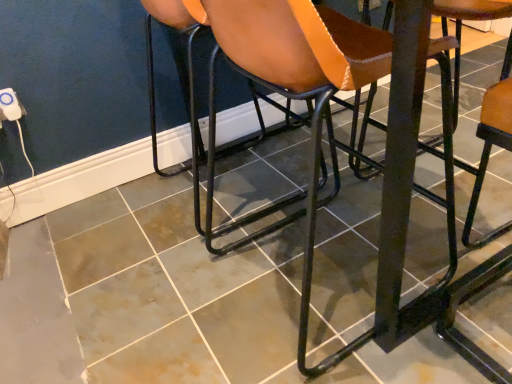
This screenshot has width=512, height=384. Find the location of `brown leather chair at center, arranged as the second chair when viewed from the right`. brown leather chair at center, arranged as the second chair when viewed from the right is located at coordinates (291, 84).

The height and width of the screenshot is (384, 512). What do you see at coordinates (291, 84) in the screenshot? I see `brown leather chair at center, arranged as the second chair when viewed from the right` at bounding box center [291, 84].

Measure the distance between brown leather chair at center, the 1th chair from the left, and camera.

A distance of 4.00 feet exists between brown leather chair at center, the 1th chair from the left, and camera.

At what (x,y) coordinates should I click in order to perform the action: click on brown leather chair at center, positioned as the second chair in left-to-right order. Please return your answer as a coordinate pair (x, y). The height and width of the screenshot is (384, 512). Looking at the image, I should click on (291, 84).

From the image's perspective, between white plastic electric outlet at lower left and metallic black stool at right, which ranks as the 1th chair in right-to-left order, who is located below?

metallic black stool at right, which ranks as the 1th chair in right-to-left order, from the image's perspective.

Which of these two, white plastic electric outlet at lower left or metallic black stool at right, which ranks as the 1th chair in right-to-left order, is bigger?

metallic black stool at right, which ranks as the 1th chair in right-to-left order.

How much distance is there between brown leather chair at center, the 1th chair from the left, and brown leather chair at center, arranged as the second chair when viewed from the right?

brown leather chair at center, the 1th chair from the left, is 11.35 inches from brown leather chair at center, arranged as the second chair when viewed from the right.

Between brown leather chair at center, the 1th chair from the left, and brown leather chair at center, arranged as the second chair when viewed from the right, which one has larger width?

brown leather chair at center, the 1th chair from the left.

From their relative heights in the image, would you say brown leather chair at center, the 1th chair from the left, is taller or shorter than brown leather chair at center, arranged as the second chair when viewed from the right?

brown leather chair at center, the 1th chair from the left, is shorter than brown leather chair at center, arranged as the second chair when viewed from the right.

Does point (234, 57) appear closer or farther from the camera than point (336, 363)?

Point (234, 57).

Visually, is metallic black stool at right, which ranks as the 1th chair in right-to-left order, positioned to the left or to the right of brown leather chair at center, arranged as the second chair when viewed from the right?

Clearly, metallic black stool at right, which ranks as the 1th chair in right-to-left order, is on the right of brown leather chair at center, arranged as the second chair when viewed from the right, in the image.

Does metallic black stool at right, which is the third chair in left-to-right order, contain brown leather chair at center, arranged as the second chair when viewed from the right?

No, brown leather chair at center, arranged as the second chair when viewed from the right, is not surrounded by metallic black stool at right, which is the third chair in left-to-right order.

Would you consider metallic black stool at right, which ranks as the 1th chair in right-to-left order, to be distant from brown leather chair at center, positioned as the second chair in left-to-right order?

metallic black stool at right, which ranks as the 1th chair in right-to-left order, is near brown leather chair at center, positioned as the second chair in left-to-right order, not far away.

From a real-world perspective, which is physically below, metallic black stool at right, which is the third chair in left-to-right order, or brown leather chair at center, positioned as the second chair in left-to-right order?

In real-world perspective, metallic black stool at right, which is the third chair in left-to-right order, is lower.

Considering the relative positions of brown leather chair at center, positioned as the second chair in left-to-right order, and metallic black stool at right, which ranks as the 1th chair in right-to-left order, in the image provided, is brown leather chair at center, positioned as the second chair in left-to-right order, to the left of metallic black stool at right, which ranks as the 1th chair in right-to-left order, from the viewer's perspective?

Yes.

How far apart are brown leather chair at center, positioned as the second chair in left-to-right order, and metallic black stool at right, which is the third chair in left-to-right order?

A distance of 13.46 inches exists between brown leather chair at center, positioned as the second chair in left-to-right order, and metallic black stool at right, which is the third chair in left-to-right order.

Where is `the 1st chair behind the brown leather chair at center, positioned as the second chair in left-to-right order, starting your count from the anchor`? The width and height of the screenshot is (512, 384). the 1st chair behind the brown leather chair at center, positioned as the second chair in left-to-right order, starting your count from the anchor is located at coordinates (465, 301).

Considering the sizes of objects brown leather chair at center, arranged as the second chair when viewed from the right, and metallic black stool at right, which ranks as the 1th chair in right-to-left order, in the image provided, who is bigger, brown leather chair at center, arranged as the second chair when viewed from the right, or metallic black stool at right, which ranks as the 1th chair in right-to-left order,?

With larger size is brown leather chair at center, arranged as the second chair when viewed from the right.

Between brown leather chair at center, positioned as the second chair in left-to-right order, and white plastic electric outlet at lower left, which one has smaller width?

white plastic electric outlet at lower left.

Does brown leather chair at center, arranged as the second chair when viewed from the right, appear on the left side of white plastic electric outlet at lower left?

No.

From a real-world perspective, is brown leather chair at center, positioned as the second chair in left-to-right order, positioned under white plastic electric outlet at lower left based on gravity?

Yes, from a real-world perspective, brown leather chair at center, positioned as the second chair in left-to-right order, is beneath white plastic electric outlet at lower left.

Can you tell me how much brown leather chair at center, the 3th chair viewed from the right, and white plastic electric outlet at lower left differ in facing direction?

The angular difference between brown leather chair at center, the 3th chair viewed from the right, and white plastic electric outlet at lower left is 88.5 degrees.

From a real-world perspective, relative to white plastic electric outlet at lower left, is brown leather chair at center, the 1th chair from the left, vertically above or below?

From a real-world perspective, brown leather chair at center, the 1th chair from the left, is physically below white plastic electric outlet at lower left.

In terms of width, does brown leather chair at center, the 3th chair viewed from the right, look wider or thinner when compared to white plastic electric outlet at lower left?

brown leather chair at center, the 3th chair viewed from the right, is wider than white plastic electric outlet at lower left.

Can you confirm if brown leather chair at center, arranged as the second chair when viewed from the right, is bigger than brown leather chair at center, the 3th chair viewed from the right?

Yes.

From the image's perspective, is brown leather chair at center, arranged as the second chair when viewed from the right, on top of brown leather chair at center, the 3th chair viewed from the right?

No, from the image's perspective, brown leather chair at center, arranged as the second chair when viewed from the right, is not above brown leather chair at center, the 3th chair viewed from the right.

Would you say brown leather chair at center, arranged as the second chair when viewed from the right, is inside or outside brown leather chair at center, the 3th chair viewed from the right?

brown leather chair at center, arranged as the second chair when viewed from the right, is not inside brown leather chair at center, the 3th chair viewed from the right, it's outside.

Find the location of a particular element. Image resolution: width=512 pixels, height=384 pixels. chair to the left of brown leather chair at center, arranged as the second chair when viewed from the right is located at coordinates (262, 85).

From a real-world perspective, which chair is the 3rd one underneath the white plastic electric outlet at lower left? Please provide its 2D coordinates.

[(465, 301)]

Starting from the brown leather chair at center, the 3th chair viewed from the right, which chair is the 1st one to the right? Please provide its 2D coordinates.

[(291, 84)]

From the image, which object appears to be nearer to metallic black stool at right, which ranks as the 1th chair in right-to-left order, white plastic electric outlet at lower left or brown leather chair at center, positioned as the second chair in left-to-right order?

Among the two, brown leather chair at center, positioned as the second chair in left-to-right order, is located nearer to metallic black stool at right, which ranks as the 1th chair in right-to-left order.

When comparing their distances from brown leather chair at center, the 3th chair viewed from the right, does brown leather chair at center, positioned as the second chair in left-to-right order, or metallic black stool at right, which is the third chair in left-to-right order, seem further?

Based on the image, metallic black stool at right, which is the third chair in left-to-right order, appears to be further to brown leather chair at center, the 3th chair viewed from the right.

Looking at this image, from the image, which object appears to be farther from brown leather chair at center, positioned as the second chair in left-to-right order, white plastic electric outlet at lower left or brown leather chair at center, the 3th chair viewed from the right?

Among the two, white plastic electric outlet at lower left is located further to brown leather chair at center, positioned as the second chair in left-to-right order.

Based on their spatial positions, is metallic black stool at right, which ranks as the 1th chair in right-to-left order, or white plastic electric outlet at lower left closer to brown leather chair at center, positioned as the second chair in left-to-right order?

Among the two, metallic black stool at right, which ranks as the 1th chair in right-to-left order, is located nearer to brown leather chair at center, positioned as the second chair in left-to-right order.

Which object lies further to the anchor point brown leather chair at center, arranged as the second chair when viewed from the right, metallic black stool at right, which is the third chair in left-to-right order, or brown leather chair at center, the 1th chair from the left?

metallic black stool at right, which is the third chair in left-to-right order, is further to brown leather chair at center, arranged as the second chair when viewed from the right.

Based on their spatial positions, is white plastic electric outlet at lower left or metallic black stool at right, which is the third chair in left-to-right order, further from brown leather chair at center, positioned as the second chair in left-to-right order?

Based on the image, white plastic electric outlet at lower left appears to be further to brown leather chair at center, positioned as the second chair in left-to-right order.

Considering their positions, is brown leather chair at center, the 1th chair from the left, positioned closer to metallic black stool at right, which ranks as the 1th chair in right-to-left order, than white plastic electric outlet at lower left?

Based on the image, brown leather chair at center, the 1th chair from the left, appears to be nearer to metallic black stool at right, which ranks as the 1th chair in right-to-left order.

Which object lies nearer to the anchor point brown leather chair at center, positioned as the second chair in left-to-right order, brown leather chair at center, the 1th chair from the left, or white plastic electric outlet at lower left?

Among the two, brown leather chair at center, the 1th chair from the left, is located nearer to brown leather chair at center, positioned as the second chair in left-to-right order.

The image size is (512, 384). Identify the location of chair located between brown leather chair at center, the 3th chair viewed from the right, and metallic black stool at right, which is the third chair in left-to-right order, in the left-right direction. (291, 84).

Identify the location of chair located between white plastic electric outlet at lower left and brown leather chair at center, positioned as the second chair in left-to-right order, in the left-right direction. The image size is (512, 384). (262, 85).